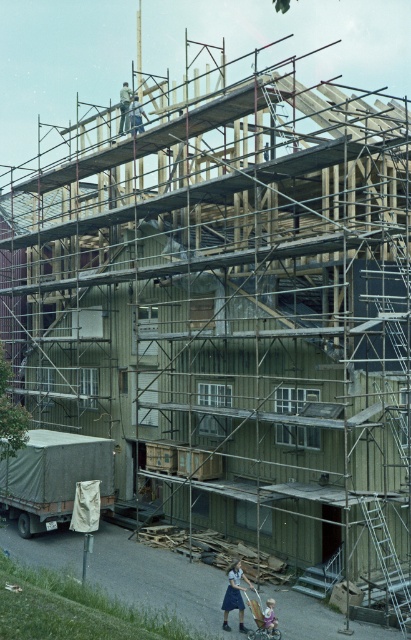
Does camouflage fabric baby carriage at lower left have a smaller size compared to wooden baby carriage at lower center?

No.

At what (x,y) coordinates should I click in order to perform the action: click on camouflage fabric baby carriage at lower left. Please return your answer as a coordinate pair (x, y). Looking at the image, I should click on (53, 476).

Who is positioned more to the left, camouflage fabric baby carriage at lower left or wooden construction worker at center?

camouflage fabric baby carriage at lower left is more to the left.

Is point (6, 502) farther from viewer compared to point (244, 625)?

That is True.

The height and width of the screenshot is (640, 411). What do you see at coordinates (53, 476) in the screenshot?
I see `camouflage fabric baby carriage at lower left` at bounding box center [53, 476].

Where is `camouflage fabric baby carriage at lower left`? The height and width of the screenshot is (640, 411). camouflage fabric baby carriage at lower left is located at coordinates (53, 476).

Between wooden construction worker at center and wooden baby carriage at lower center, which one appears on the left side from the viewer's perspective?

Positioned to the left is wooden construction worker at center.

Identify the location of wooden construction worker at center. The width and height of the screenshot is (411, 640). (235, 595).